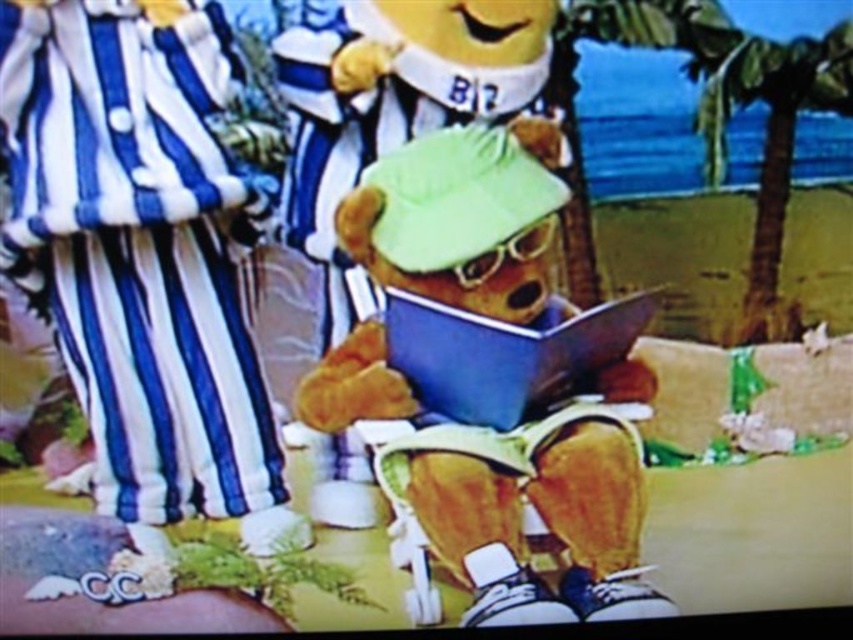
Question: Among these points, which one is farthest from the camera?

Choices:
 (A) (415, 388)
 (B) (422, 145)

Answer: (A)

Question: Is fluffy brown teddy bear at center behind blue matte book at center?

Choices:
 (A) no
 (B) yes

Answer: (A)

Question: Does fluffy brown teddy bear at center have a greater width compared to green leafy palm tree at upper right?

Choices:
 (A) no
 (B) yes

Answer: (B)

Question: Can you confirm if green leafy palm tree at upper right is positioned below blue matte book at center?

Choices:
 (A) yes
 (B) no

Answer: (B)

Question: Which point appears closest to the camera in this image?

Choices:
 (A) (511, 532)
 (B) (776, 289)
 (C) (622, 314)

Answer: (B)

Question: Among these points, which one is farthest from the camera?

Choices:
 (A) 767,323
 (B) 422,385
 (C) 531,301

Answer: (A)